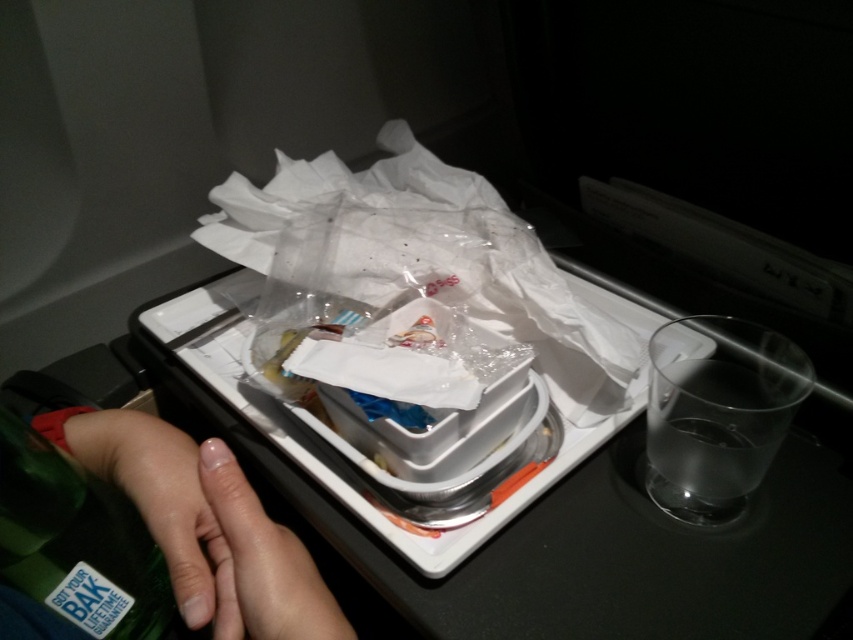
Is transparent plastic bag at center thinner than green matte bottle at lower left?

No.

In the scene shown: Who is positioned more to the right, transparent plastic bag at center or green matte bottle at lower left?

Positioned to the right is transparent plastic bag at center.

Does point (253, 204) come closer to viewer compared to point (49, 484)?

That is False.

This screenshot has height=640, width=853. I want to click on transparent plastic bag at center, so click(x=344, y=193).

Is skinsmoothhand at center taller than green matte bottle at lower left?

No, skinsmoothhand at center is not taller than green matte bottle at lower left.

Does point (114, 451) lie behind point (80, 608)?

Yes, point (114, 451) is behind point (80, 608).

Describe the element at coordinates (207, 529) in the screenshot. The height and width of the screenshot is (640, 853). I see `skinsmoothhand at center` at that location.

The height and width of the screenshot is (640, 853). In order to click on skinsmoothhand at center in this screenshot , I will do `click(207, 529)`.

What are the coordinates of `transparent plastic bag at center` in the screenshot? It's located at (344, 193).

Who is taller, transparent plastic bag at center or skinsmoothhand at center?

Standing taller between the two is transparent plastic bag at center.

Between point (234, 173) and point (227, 524), which one is positioned in front?

Point (227, 524) is more forward.

Identify the location of transparent plastic bag at center. Image resolution: width=853 pixels, height=640 pixels. (344, 193).